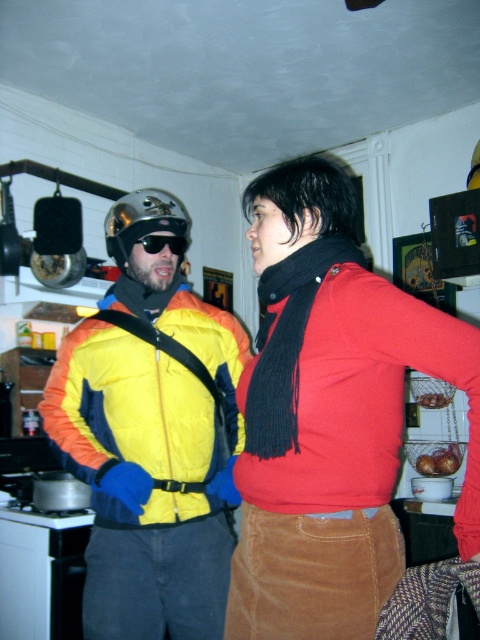
Consider the image. You are standing in the kitchen and need to place a new red corduroy skirt at center. Where should you position it based on the existing layout?

The red corduroy skirt at center should be placed at the 2D coordinates point (331, 417).

You are trying to decide which item to pack first for your trip. You see the black fuzzy scarf at center and the black plastic goggles at upper left. Which item takes up more space?

The black fuzzy scarf at center is bigger than the black plastic goggles at upper left, so it takes up more space.